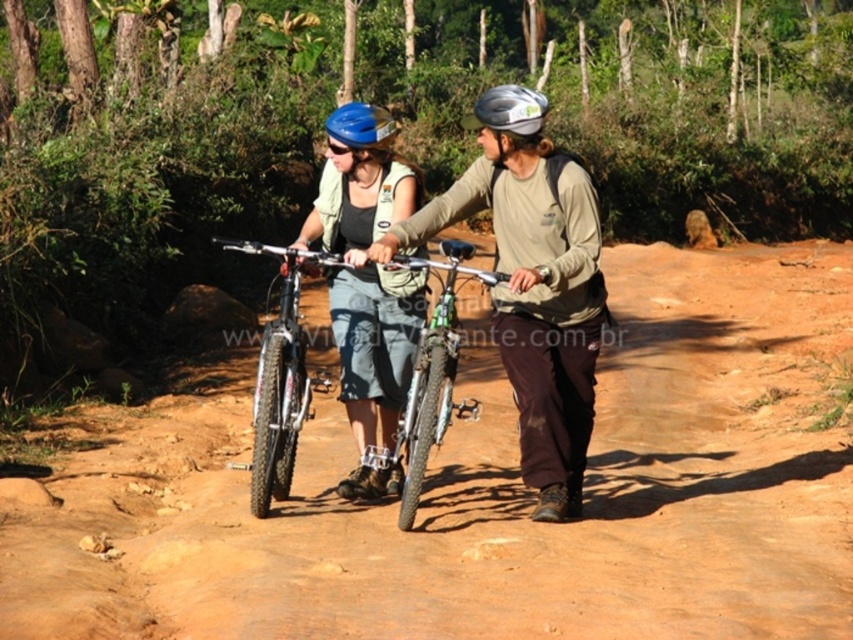
You are a photographer positioned at the dirt path. You want to take a photo focusing on the matte black bicycle at center and the silver metallic helmet at center. Which object will appear larger in the photo?

The matte black bicycle at center will appear larger in the photo because it is closer to the viewer than the silver metallic helmet at center.

You are a hiker who needs to decide whether to carry your matte black bicycle at center or your blue matte bicycle helmet at center up a steep hill. Based on their sizes, which item should you choose to carry more easily?

The blue matte bicycle helmet at center is smaller than the matte black bicycle at center, so it would be easier to carry the blue matte bicycle helmet at center up the steep hill.